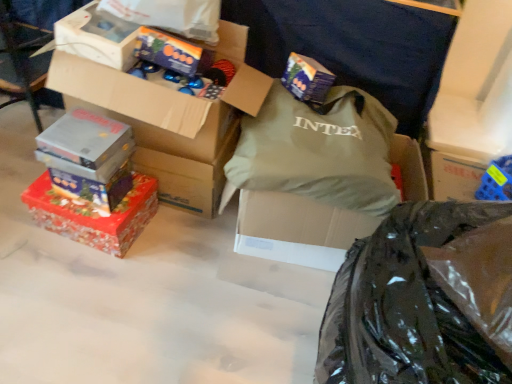
This screenshot has height=384, width=512. I want to click on vacant space situated above white plastic box at upper left, acting as the fourth box starting from the right (from a real-world perspective), so pyautogui.click(x=110, y=5).